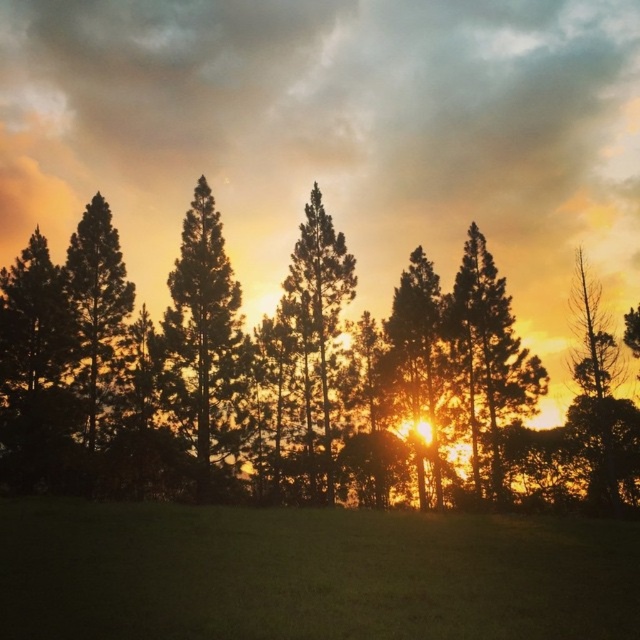
This screenshot has height=640, width=640. I want to click on silhouette pine tree at left, so click(97, 304).

In the scene shown: Between silhouette pine tree at left and golden textured tree at center, which one appears on the left side from the viewer's perspective?

silhouette pine tree at left

The height and width of the screenshot is (640, 640). What are the coordinates of `silhouette pine tree at left` in the screenshot? It's located at (97, 304).

The width and height of the screenshot is (640, 640). What are the coordinates of `silhouette pine tree at left` in the screenshot? It's located at (97, 304).

Which is below, silhouette trees at center or bare wood tree at right?

silhouette trees at center is below.

At what (x,y) coordinates should I click in order to perform the action: click on silhouette trees at center. Please return your answer as a coordinate pair (x, y). Looking at the image, I should click on (292, 380).

Consider the image. Who is taller, silhouette wood tree at center or silhouette pine tree at center?

silhouette pine tree at center

From the picture: Is silhouette wood tree at center wider than silhouette pine tree at center?

Yes.

Who is more forward, [216,294] or [321,324]?

Point [216,294]

This screenshot has height=640, width=640. Find the location of `silhouette wood tree at center`. silhouette wood tree at center is located at coordinates (x=204, y=339).